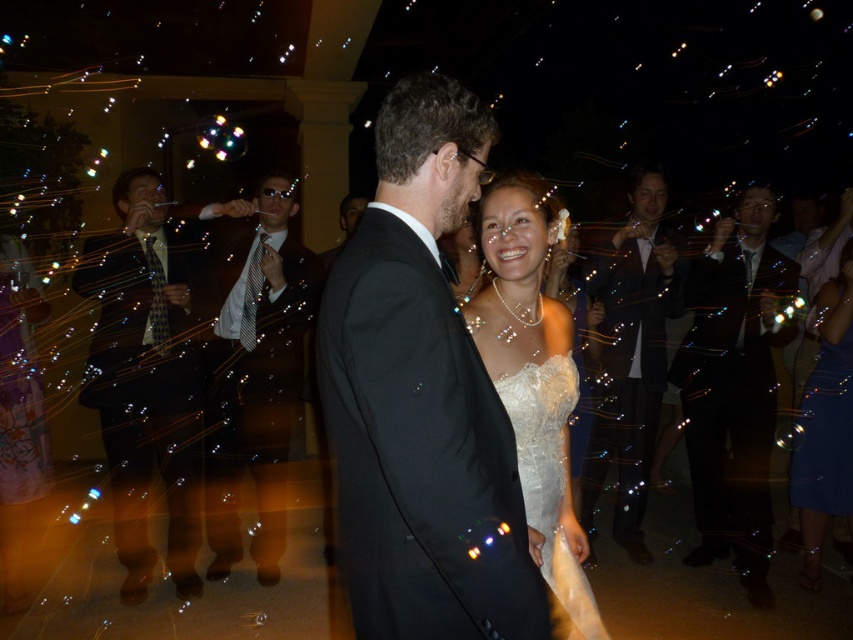
Question: Which point appears farthest from the camera in this image?

Choices:
 (A) (573, 566)
 (B) (183, 592)
 (C) (640, 428)
 (D) (288, 339)

Answer: (C)

Question: Can you confirm if black satin suit at right is positioned to the left of white lace dress at center?

Choices:
 (A) no
 (B) yes

Answer: (A)

Question: Does black satin suit at center appear under shiny black suit at left?

Choices:
 (A) no
 (B) yes

Answer: (A)

Question: Based on their relative distances, which object is farther from the black satin suit at right?

Choices:
 (A) shiny black suit at left
 (B) shiny black suit at right
 (C) shiny black suit at center

Answer: (A)

Question: Which is farther from the black satin suit at right?

Choices:
 (A) black satin suit at center
 (B) white lace dress at center

Answer: (A)

Question: Can you confirm if white satin dress at center is positioned to the right of white lace dress at center?

Choices:
 (A) yes
 (B) no

Answer: (B)